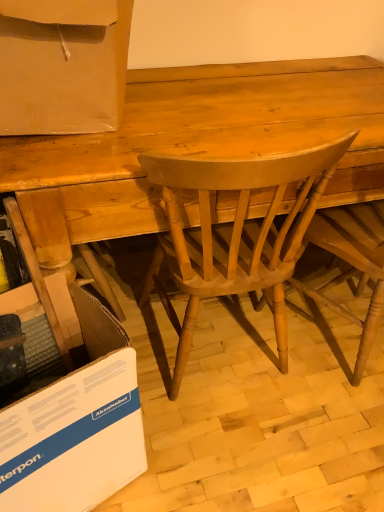
Question: Which direction should I rotate to look at light brown wood chair at center, which is the 1th chair from left to right?

Choices:
 (A) right
 (B) left

Answer: (A)

Question: Considering the relative sizes of matte cardboard box at upper left and light brown wood chair at center, the second chair viewed from the left, in the image provided, is matte cardboard box at upper left wider than light brown wood chair at center, the second chair viewed from the left,?

Choices:
 (A) no
 (B) yes

Answer: (A)

Question: Does matte cardboard box at upper left turn towards light brown wood chair at center, arranged as the first chair when viewed from the right?

Choices:
 (A) yes
 (B) no

Answer: (B)

Question: Can you confirm if matte cardboard box at upper left is thinner than light brown wood chair at center, the second chair viewed from the left?

Choices:
 (A) yes
 (B) no

Answer: (A)

Question: Is matte cardboard box at upper left positioned in front of light brown wood chair at center, the second chair viewed from the left?

Choices:
 (A) no
 (B) yes

Answer: (B)

Question: Considering the relative sizes of matte cardboard box at upper left and light brown wood chair at center, arranged as the first chair when viewed from the right, in the image provided, is matte cardboard box at upper left bigger than light brown wood chair at center, arranged as the first chair when viewed from the right,?

Choices:
 (A) yes
 (B) no

Answer: (B)

Question: Is matte cardboard box at upper left looking in the opposite direction of light brown wood chair at center, the second chair viewed from the left?

Choices:
 (A) no
 (B) yes

Answer: (A)

Question: Is matte cardboard box at upper left bigger than light brown wood chair at center, arranged as the 2th chair when viewed from the right?

Choices:
 (A) yes
 (B) no

Answer: (B)

Question: From a real-world perspective, is matte cardboard box at upper left over light brown wood chair at center, which is the 1th chair from left to right?

Choices:
 (A) no
 (B) yes

Answer: (B)

Question: Can you confirm if matte cardboard box at upper left is smaller than light brown wood chair at center, which is the 1th chair from left to right?

Choices:
 (A) no
 (B) yes

Answer: (B)

Question: Can you confirm if matte cardboard box at upper left is positioned to the right of light brown wood chair at center, which is the 1th chair from left to right?

Choices:
 (A) no
 (B) yes

Answer: (A)

Question: From the image's perspective, is matte cardboard box at upper left located above light brown wood chair at center, which is the 1th chair from left to right?

Choices:
 (A) yes
 (B) no

Answer: (A)

Question: Considering the relative positions of matte cardboard box at upper left and light brown wood chair at center, which is the 1th chair from left to right, in the image provided, is matte cardboard box at upper left to the left of light brown wood chair at center, which is the 1th chair from left to right, from the viewer's perspective?

Choices:
 (A) no
 (B) yes

Answer: (B)

Question: Is the position of white cardboard at lower left less distant than that of matte cardboard box at upper left?

Choices:
 (A) no
 (B) yes

Answer: (B)